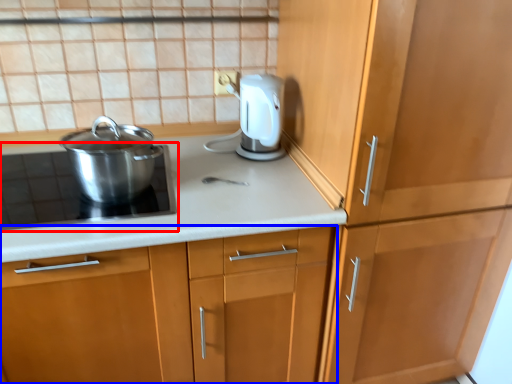
Question: Among these objects, which one is farthest to the camera, home appliance (highlighted by a red box) or cabinetry (highlighted by a blue box)?

Choices:
 (A) home appliance
 (B) cabinetry

Answer: (A)